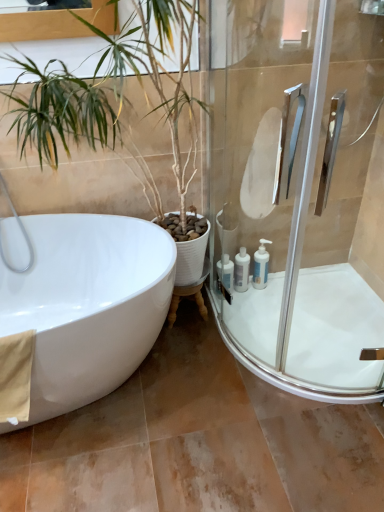
Question: Is clear glass shower door at right inside beige fabric towel at lower left?

Choices:
 (A) no
 (B) yes

Answer: (A)

Question: Does beige fabric towel at lower left have a lesser height compared to clear glass shower door at right?

Choices:
 (A) no
 (B) yes

Answer: (B)

Question: Is beige fabric towel at lower left behind clear glass shower door at right?

Choices:
 (A) no
 (B) yes

Answer: (B)

Question: Is beige fabric towel at lower left aimed at clear glass shower door at right?

Choices:
 (A) no
 (B) yes

Answer: (A)

Question: Is beige fabric towel at lower left far from clear glass shower door at right?

Choices:
 (A) no
 (B) yes

Answer: (B)

Question: Are beige fabric towel at lower left and clear glass shower door at right beside each other?

Choices:
 (A) yes
 (B) no

Answer: (B)

Question: From a real-world perspective, is green leafy plant at left under beige fabric towel at lower left?

Choices:
 (A) no
 (B) yes

Answer: (A)

Question: Is the depth of green leafy plant at left greater than that of beige fabric towel at lower left?

Choices:
 (A) yes
 (B) no

Answer: (B)

Question: Is green leafy plant at left closer to camera compared to beige fabric towel at lower left?

Choices:
 (A) no
 (B) yes

Answer: (B)

Question: From the image's perspective, would you say green leafy plant at left is shown under beige fabric towel at lower left?

Choices:
 (A) yes
 (B) no

Answer: (B)

Question: Is green leafy plant at left next to beige fabric towel at lower left?

Choices:
 (A) no
 (B) yes

Answer: (A)

Question: From a real-world perspective, is green leafy plant at left physically above beige fabric towel at lower left?

Choices:
 (A) yes
 (B) no

Answer: (A)

Question: Does white glossy bathtub at left come behind white plastic bottles at lower right, the 3th toiletry viewed from the right?

Choices:
 (A) yes
 (B) no

Answer: (B)